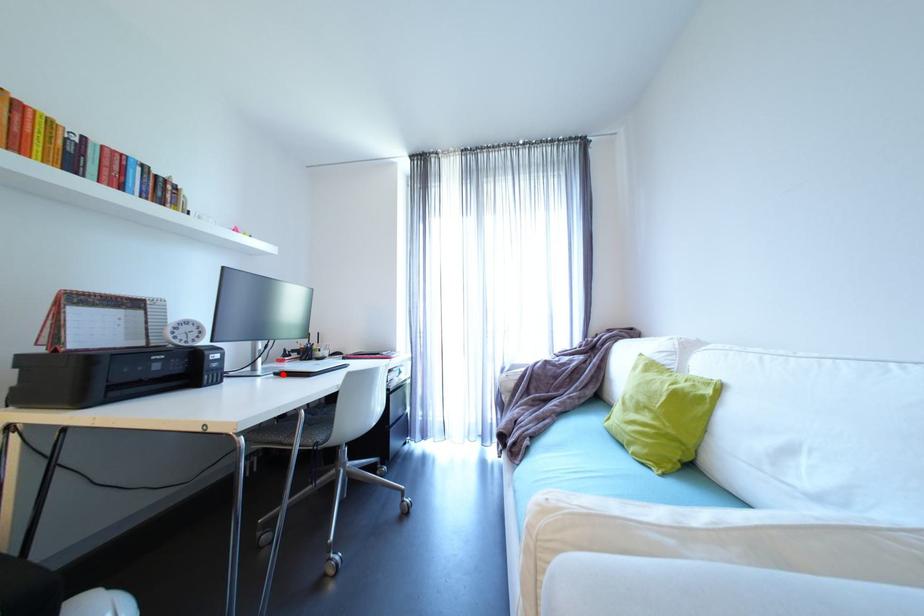
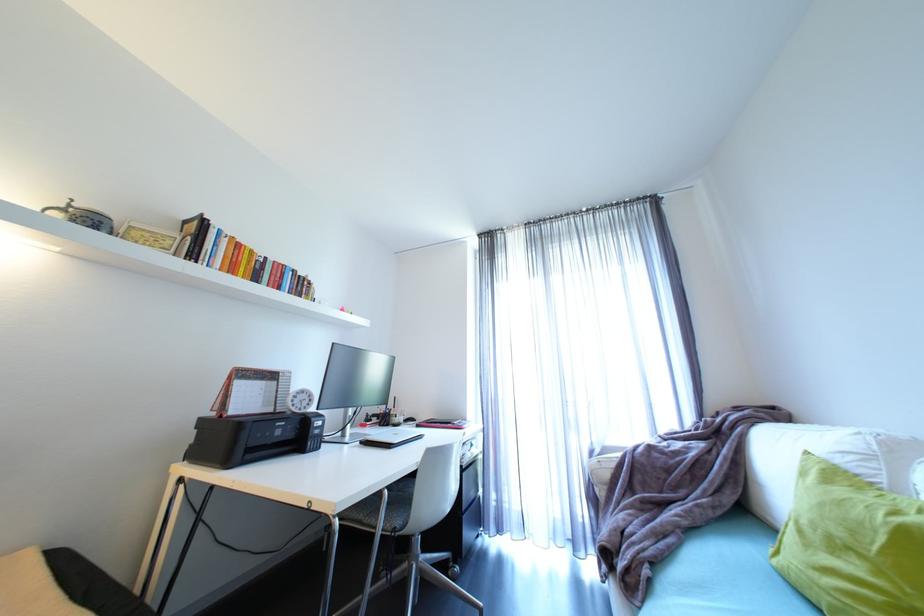
Where in the second image is the point corresponding to the highlighted location from the first image?

(369, 443)